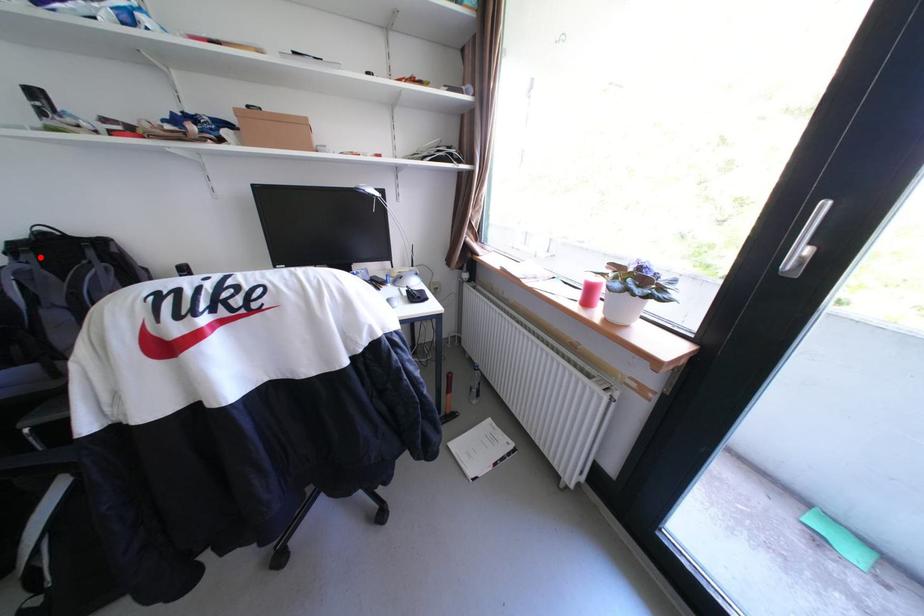
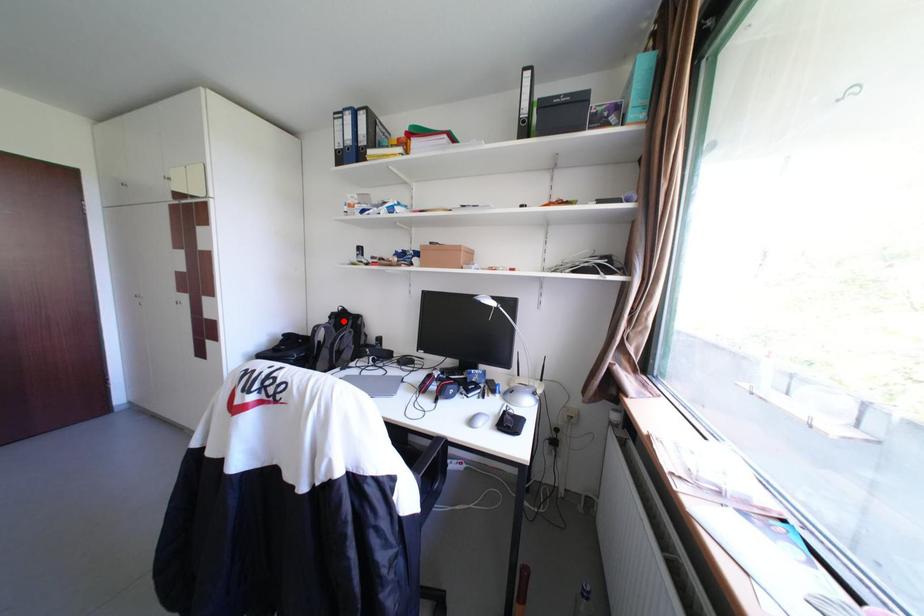
I am providing you with two images of the same scene from different viewpoints. A red point is marked on the first image and another point is marked on the second image. Does the point marked in image1 correspond to the same location as the one in image2?

Yes